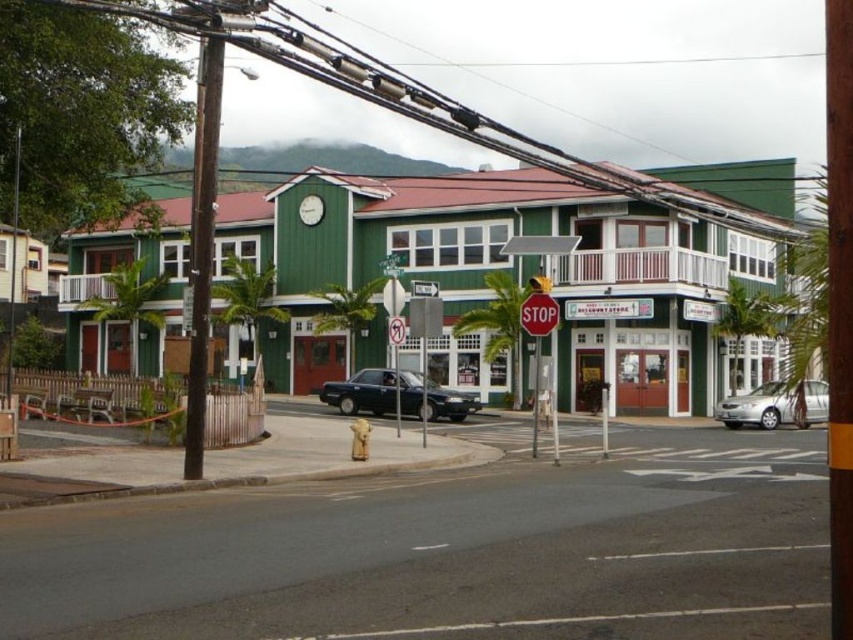
Is satin black sedan at center bigger than green plastic sign at center?

No, satin black sedan at center is not bigger than green plastic sign at center.

Between satin black sedan at center and green plastic sign at center, which one has less height?

Standing shorter between the two is satin black sedan at center.

Is point (344, 403) more distant than point (386, 259)?

No, it is in front of (386, 259).

The width and height of the screenshot is (853, 640). Find the location of `satin black sedan at center`. satin black sedan at center is located at coordinates (363, 392).

Does brown wooden pole at left have a greater height compared to silver metallic sedan at lower right?

Yes, brown wooden pole at left is taller than silver metallic sedan at lower right.

Which is more to the right, brown wooden pole at left or silver metallic sedan at lower right?

Positioned to the right is silver metallic sedan at lower right.

Describe the element at coordinates (201, 244) in the screenshot. Image resolution: width=853 pixels, height=640 pixels. I see `brown wooden pole at left` at that location.

At what (x,y) coordinates should I click in order to perform the action: click on brown wooden pole at left. Please return your answer as a coordinate pair (x, y). This screenshot has height=640, width=853. Looking at the image, I should click on (201, 244).

Based on the photo, who is more forward, (843, 362) or (422, 282)?

Point (843, 362)

Does point (843, 176) come closer to viewer compared to point (427, 282)?

That is True.

Find the location of a particular element. The width and height of the screenshot is (853, 640). brown wooden pole at center-left is located at coordinates (839, 307).